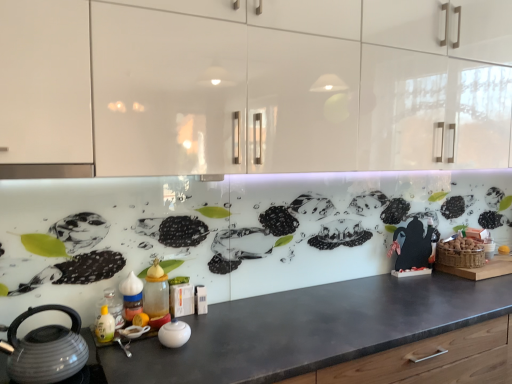
Image resolution: width=512 pixels, height=384 pixels. I want to click on vacant space to the right of matte gray kettle at lower left, so click(x=119, y=361).